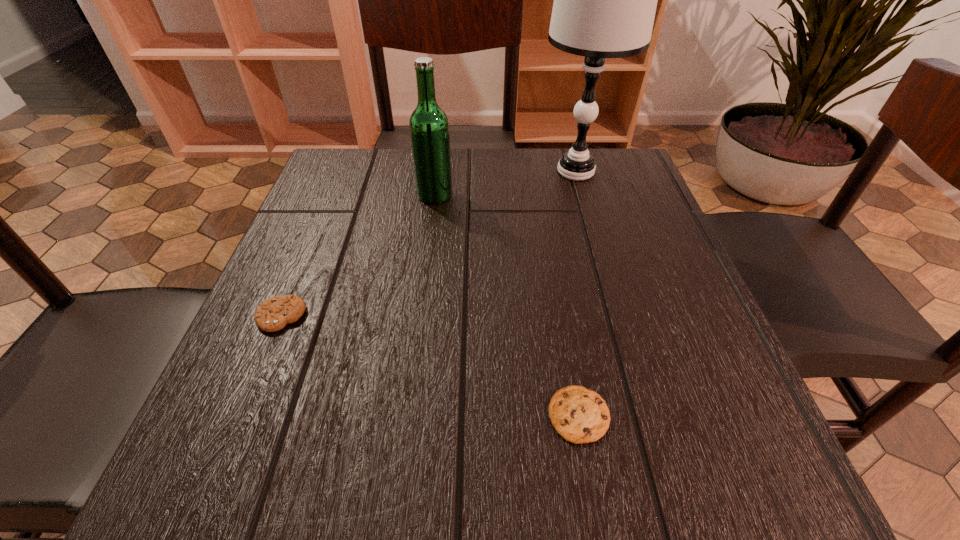
In order to click on vacant space situated 0.310m on the back of the nearer cookie in this screenshot , I will do `click(550, 247)`.

Find the location of a particular element. The height and width of the screenshot is (540, 960). table lamp located at the far edge is located at coordinates (605, 0).

Find the location of `beer bottle that is positioned at the far edge`. beer bottle that is positioned at the far edge is located at coordinates (x=429, y=128).

The width and height of the screenshot is (960, 540). Identify the location of object that is positioned at the near edge. (578, 414).

Locate an element on the screen. The height and width of the screenshot is (540, 960). object positioned at the left edge is located at coordinates (273, 314).

Image resolution: width=960 pixels, height=540 pixels. I want to click on object located at the right edge, so click(x=605, y=0).

Find the location of a particular element. This screenshot has width=960, height=540. object that is at the far right corner is located at coordinates (605, 0).

At what (x,y) coordinates should I click in order to perform the action: click on vacant space at the far edge of the desktop. Please return your answer as a coordinate pair (x, y). Looking at the image, I should click on (x=516, y=159).

I want to click on blank space at the near edge of the desktop, so click(541, 462).

At what (x,y) coordinates should I click in order to perform the action: click on free point at the left edge. Please return your answer as a coordinate pair (x, y). Looking at the image, I should click on (250, 389).